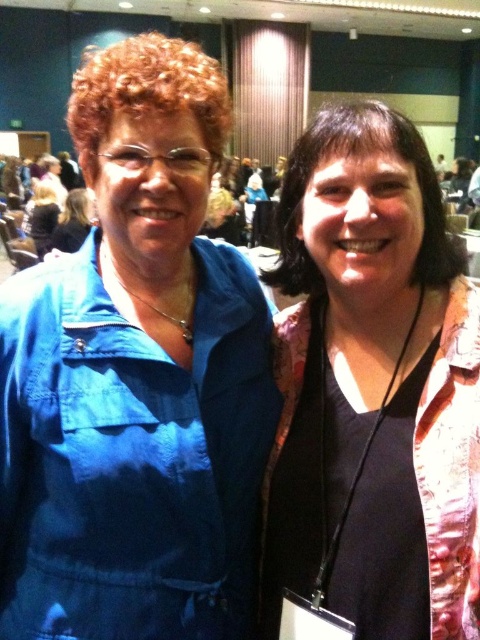
You are standing in a conference hall and see the denim jacket at left. If you want to take a photo of it, where should you aim your camera?

You should aim your camera at point (136, 378) to capture the denim jacket at left.

You are a photographer in a conference hall. You need to capture a photo of the denim jacket at left and the matte black shirt at center. The camera has a minimum focus distance of 7 inches. Can you focus on both objects without moving closer?

The distance between the denim jacket at left and matte black shirt at center is 7.73 inches, which is greater than the camera minimum focus distance of 7 inches. Therefore, the camera can focus on both objects without moving closer.

You are organizing a photo shoot and need to arrange the denim jacket at left and the matte black shirt at center in a straight line from left to right. Based on their current positions, which item should be placed first on the left side?

The denim jacket at left should be placed first on the left side since it is already positioned on the left side of the matte black shirt at center.